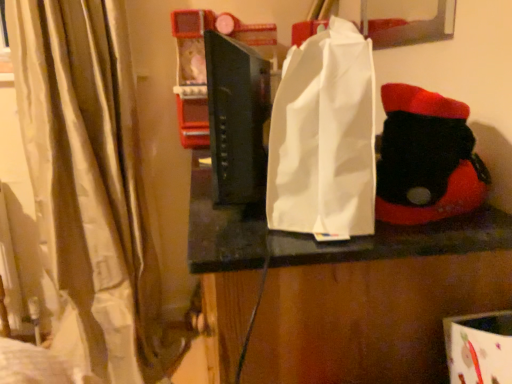
Question: From a real-world perspective, is black matte book at center beneath beige fabric curtain at left?

Choices:
 (A) yes
 (B) no

Answer: (B)

Question: From the image's perspective, is black matte book at center located beneath beige fabric curtain at left?

Choices:
 (A) no
 (B) yes

Answer: (A)

Question: Does black matte book at center have a lesser height compared to beige fabric curtain at left?

Choices:
 (A) no
 (B) yes

Answer: (B)

Question: Considering the relative sizes of black matte book at center and beige fabric curtain at left in the image provided, is black matte book at center taller than beige fabric curtain at left?

Choices:
 (A) yes
 (B) no

Answer: (B)

Question: Can beige fabric curtain at left be found inside black matte book at center?

Choices:
 (A) no
 (B) yes

Answer: (A)

Question: Does black matte book at center lie in front of beige fabric curtain at left?

Choices:
 (A) no
 (B) yes

Answer: (B)

Question: Is black felt boot at right positioned behind white paper bag at center?

Choices:
 (A) yes
 (B) no

Answer: (A)

Question: Is black felt boot at right looking in the opposite direction of white paper bag at center?

Choices:
 (A) yes
 (B) no

Answer: (B)

Question: Does black felt boot at right appear on the left side of white paper bag at center?

Choices:
 (A) no
 (B) yes

Answer: (A)

Question: Considering the relative sizes of black felt boot at right and white paper bag at center in the image provided, is black felt boot at right thinner than white paper bag at center?

Choices:
 (A) yes
 (B) no

Answer: (B)

Question: From a real-world perspective, is black felt boot at right physically above white paper bag at center?

Choices:
 (A) no
 (B) yes

Answer: (A)

Question: Does black felt boot at right touch white paper bag at center?

Choices:
 (A) yes
 (B) no

Answer: (B)

Question: Is black felt boot at right located within white paper bag at center?

Choices:
 (A) yes
 (B) no

Answer: (B)